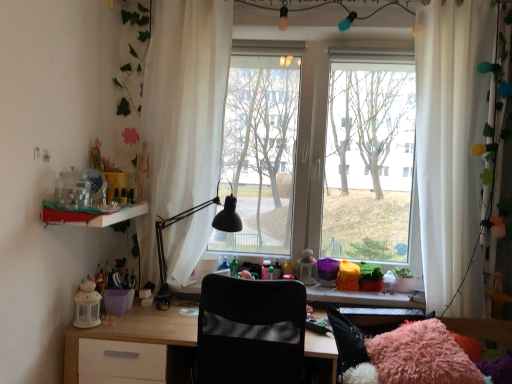
Where is `free space above transparent glass window at center (from a real-world perspective)`? free space above transparent glass window at center (from a real-world perspective) is located at coordinates [x=335, y=30].